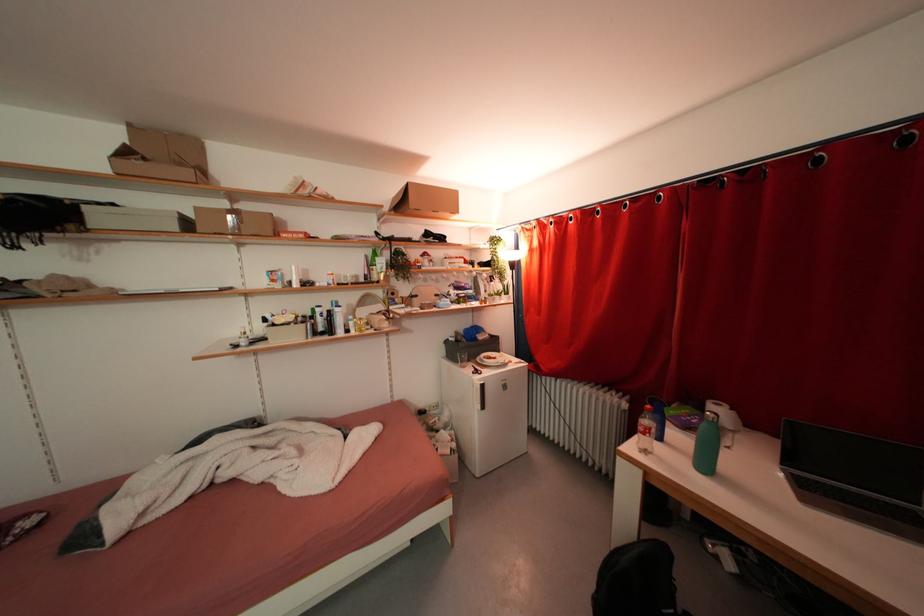
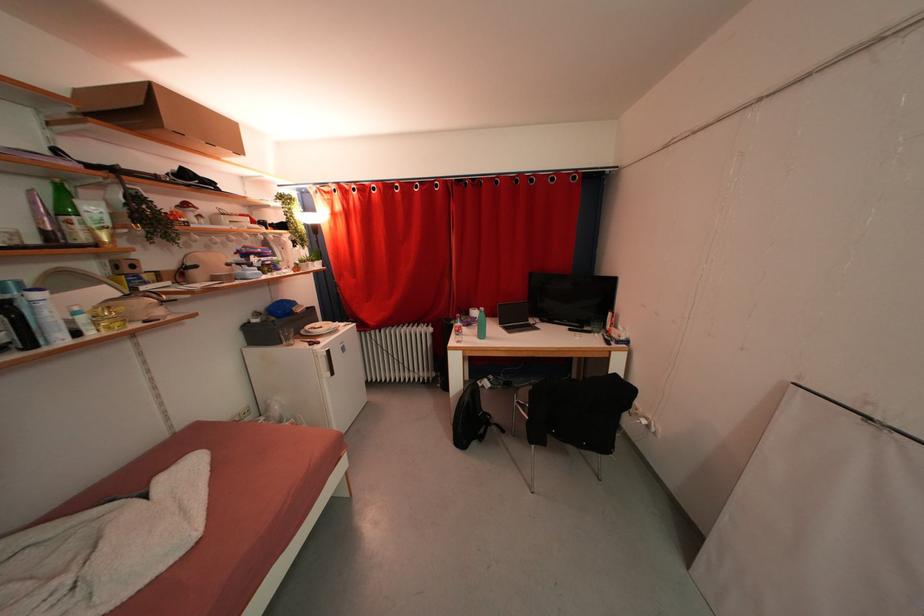
Where in the second image is the point corresponding to the point at 453,205 from the first image?

(226, 137)